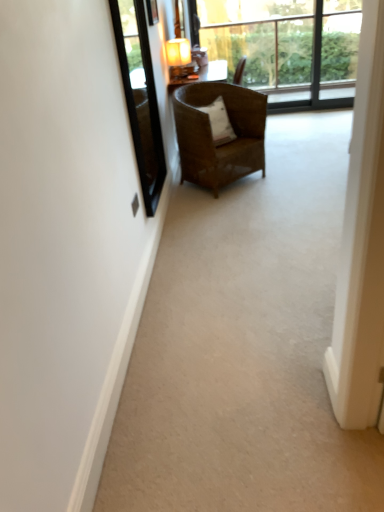
Where is `vacant space behind white glossy screen door at right`? vacant space behind white glossy screen door at right is located at coordinates (306, 406).